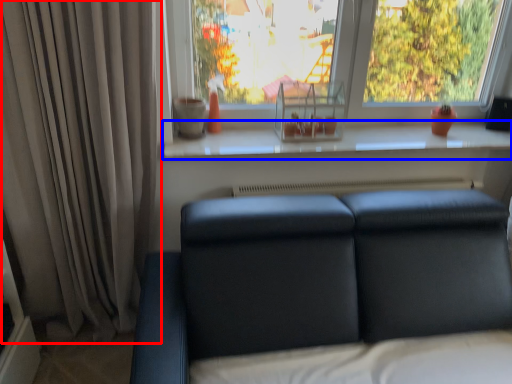
Question: Which of the following is the farthest to the observer, curtain (highlighted by a red box) or window sill (highlighted by a blue box)?

Choices:
 (A) curtain
 (B) window sill

Answer: (B)